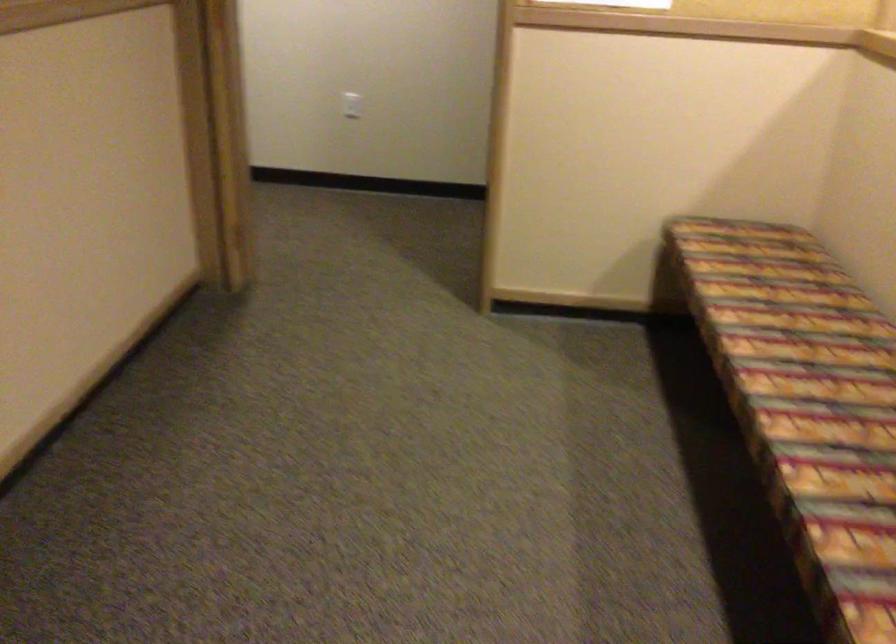
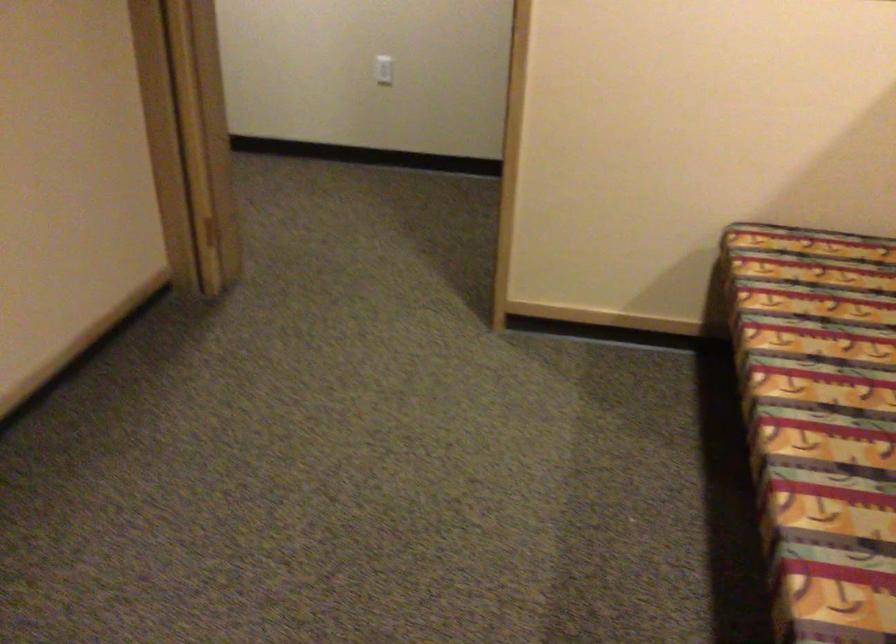
Which direction would the cameraman need to move to produce the second image?

The cameraman moved toward right, forward.